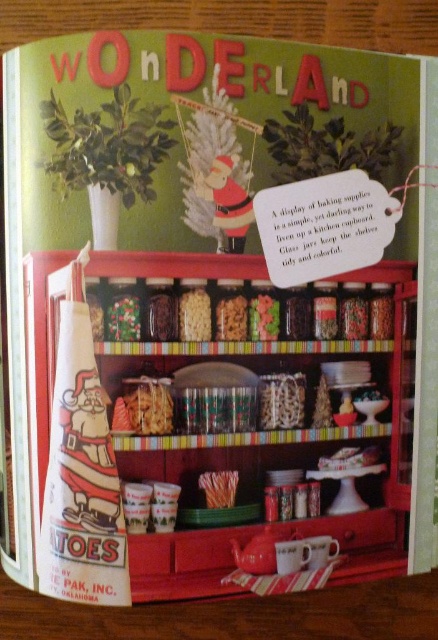
Is matte glass jars at center positioned at the back of wooden table at lower center?

No, matte glass jars at center is in front of wooden table at lower center.

Is matte glass jars at center wider than wooden table at lower center?

Incorrect, matte glass jars at center's width does not surpass wooden table at lower center's.

Who is more forward, (209, 433) or (371, 598)?

Point (209, 433)

I want to click on matte glass jars at center, so click(x=208, y=429).

Who is shorter, matte glass jars at center or white matte pasta at center?

white matte pasta at center

Measure the distance between matte glass jars at center and camera.

matte glass jars at center is 55.92 centimeters from camera.

Where is `matte glass jars at center`? matte glass jars at center is located at coordinates (208, 429).

Can you confirm if wooden table at lower center is positioned to the right of orange textured sticks at center?

Indeed, wooden table at lower center is positioned on the right side of orange textured sticks at center.

Describe the element at coordinates (236, 614) in the screenshot. I see `wooden table at lower center` at that location.

At what (x,y) coordinates should I click in order to perform the action: click on wooden table at lower center. Please return your answer as a coordinate pair (x, y). This screenshot has width=438, height=640. Looking at the image, I should click on (236, 614).